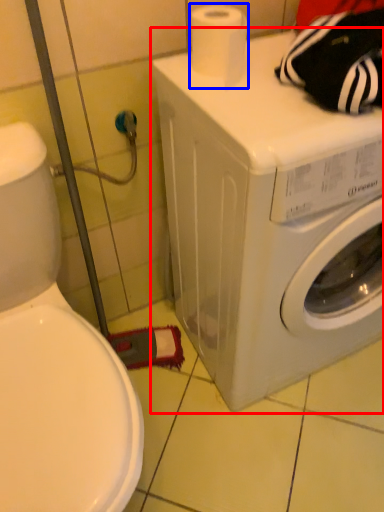
Question: Which object appears farthest to the camera in this image, washing machine (highlighted by a red box) or toilet paper (highlighted by a blue box)?

Choices:
 (A) washing machine
 (B) toilet paper

Answer: (B)